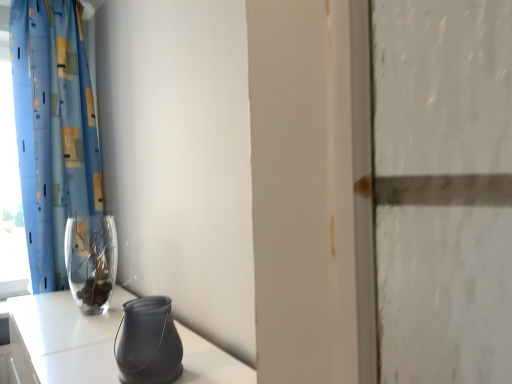
Question: Is matte black vase at lower center, positioned as the 2th vase in back-to-front order, taller than transparent glass window at left?

Choices:
 (A) no
 (B) yes

Answer: (A)

Question: Is matte black vase at lower center, which is counted as the first vase, starting from the right, beside transparent glass window at left?

Choices:
 (A) no
 (B) yes

Answer: (A)

Question: Is matte black vase at lower center, the 1th vase in the front-to-back sequence, positioned with its back to transparent glass window at left?

Choices:
 (A) yes
 (B) no

Answer: (B)

Question: Considering the relative positions of matte black vase at lower center, which appears as the second vase when viewed from the left, and transparent glass window at left in the image provided, is matte black vase at lower center, which appears as the second vase when viewed from the left, behind transparent glass window at left?

Choices:
 (A) no
 (B) yes

Answer: (A)

Question: Is matte black vase at lower center, which appears as the second vase when viewed from the left, positioned far away from transparent glass window at left?

Choices:
 (A) no
 (B) yes

Answer: (B)

Question: Does matte black vase at lower center, the 1th vase in the front-to-back sequence, have a smaller size compared to transparent glass window at left?

Choices:
 (A) no
 (B) yes

Answer: (B)

Question: Can you confirm if transparent glass vase at left, which is the second vase from front to back, is thinner than blue printed fabric curtain at left?

Choices:
 (A) no
 (B) yes

Answer: (B)

Question: From the image's perspective, would you say transparent glass vase at left, the 1th vase in the left-to-right sequence, is shown under blue printed fabric curtain at left?

Choices:
 (A) no
 (B) yes

Answer: (B)

Question: Is the position of transparent glass vase at left, the 1th vase from the back, more distant than that of blue printed fabric curtain at left?

Choices:
 (A) no
 (B) yes

Answer: (A)

Question: Is transparent glass vase at left, which is the second vase from front to back, closer to the viewer compared to blue printed fabric curtain at left?

Choices:
 (A) yes
 (B) no

Answer: (A)

Question: Is blue printed fabric curtain at left at the back of transparent glass vase at left, which is the second vase from front to back?

Choices:
 (A) yes
 (B) no

Answer: (B)

Question: Does transparent glass vase at left, the 1th vase from the back, have a greater width compared to blue printed fabric curtain at left?

Choices:
 (A) yes
 (B) no

Answer: (B)

Question: Is matte black vase at lower center, positioned as the 2th vase in back-to-front order, bigger than blue printed fabric curtain at left?

Choices:
 (A) yes
 (B) no

Answer: (B)